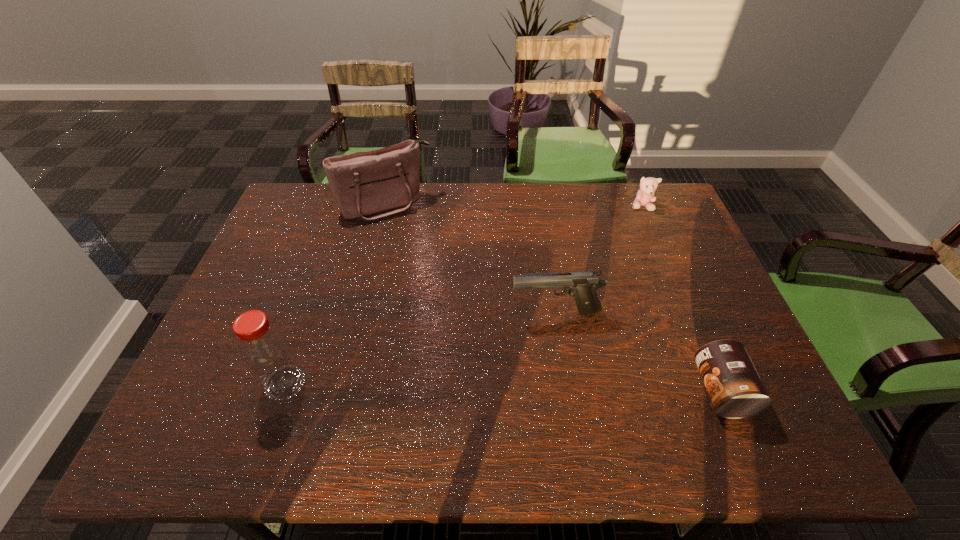
I want to click on bottle, so click(x=266, y=352).

Find the location of a particular element. The image size is (960, 540). can is located at coordinates (735, 388).

This screenshot has height=540, width=960. I want to click on teddy bear, so click(646, 196).

Locate an element on the screen. The image size is (960, 540). shoulder bag is located at coordinates tap(368, 185).

Locate an element on the screen. the third farthest object is located at coordinates (582, 285).

Where is `the third object from left to right`? Image resolution: width=960 pixels, height=540 pixels. the third object from left to right is located at coordinates (582, 285).

Where is `free space located on the right of the bottle`? This screenshot has height=540, width=960. free space located on the right of the bottle is located at coordinates (349, 383).

Locate an element on the screen. free space located 0.110m on the front label of the can is located at coordinates (649, 390).

Identify the location of free space located on the front label of the can. The width and height of the screenshot is (960, 540). (675, 390).

The image size is (960, 540). I want to click on free location located on the front label of the can, so click(x=520, y=390).